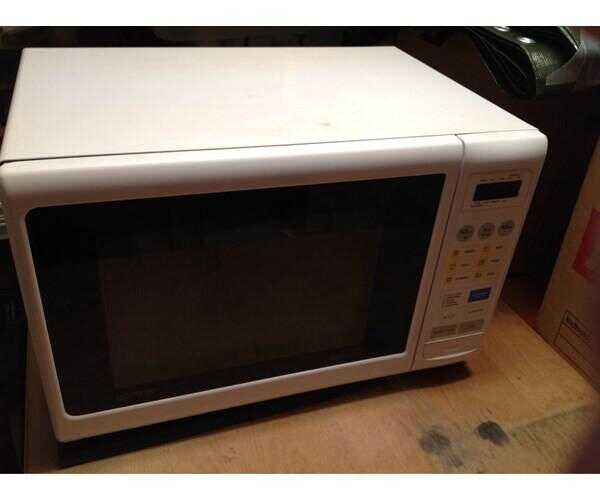
The height and width of the screenshot is (500, 600). Find the location of `1 top of microwave`. 1 top of microwave is located at coordinates (327, 121).